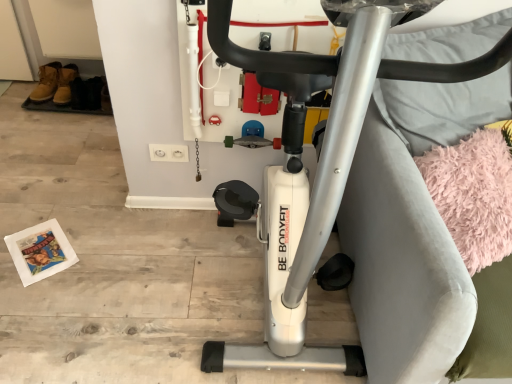
Image resolution: width=512 pixels, height=384 pixels. I want to click on free space that is to the left of silver metallic stationary bicycle at center, so click(124, 282).